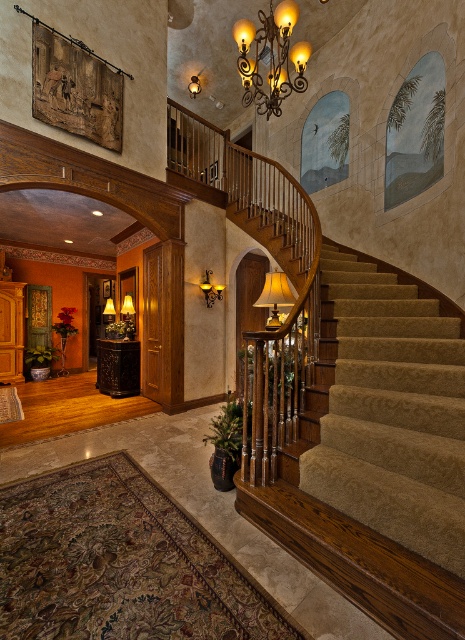
Question: Does matte gold wall sconce at upper center have a smaller size compared to matte gold lampshade at upper center?

Choices:
 (A) yes
 (B) no

Answer: (A)

Question: Can you confirm if golden wrought iron chandelier at upper center is positioned below matte gold lampshade at upper center?

Choices:
 (A) no
 (B) yes

Answer: (A)

Question: Estimate the real-world distances between objects in this image. Which object is farther from the golden wrought iron chandelier at upper center?

Choices:
 (A) matte gold lamp at center
 (B) carpeted stairs at center

Answer: (B)

Question: Which object appears farthest from the camera in this image?

Choices:
 (A) golden wrought iron chandelier at upper center
 (B) matte black lampshade at upper center

Answer: (B)

Question: Which point is closer to the camera?

Choices:
 (A) (277, 90)
 (B) (439, 435)
 (C) (212, 298)

Answer: (B)

Question: From the image, what is the correct spatial relationship of matte gold lamp at center in relation to matte gold lampshade at upper center?

Choices:
 (A) right
 (B) left

Answer: (A)